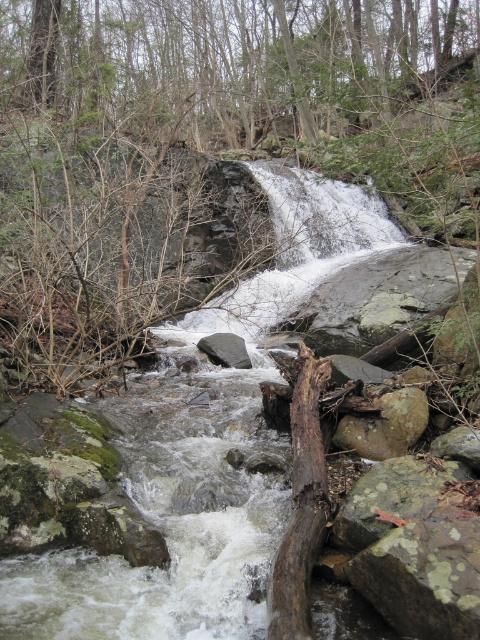
Who is lower down, brown rough log at center or gray rock at center?

brown rough log at center is below.

Who is more distant from viewer, [304,403] or [232,337]?

The point [232,337] is more distant.

Is point (324, 451) positioned in front of point (228, 364)?

Yes, it is in front of point (228, 364).

The width and height of the screenshot is (480, 640). I want to click on brown rough log at center, so click(300, 504).

Consider the image. Is green leafy tree at upper center to the right of brown rough rock at center from the viewer's perspective?

No, green leafy tree at upper center is not to the right of brown rough rock at center.

Who is more forward, (x=96, y=65) or (x=417, y=412)?

Positioned in front is point (x=417, y=412).

Locate an element on the screen. green leafy tree at upper center is located at coordinates (225, 64).

Which is more to the right, white rocky stream at center or gray rock at center?

white rocky stream at center is more to the right.

Is white rocky stream at center to the left of gray rock at center from the viewer's perspective?

In fact, white rocky stream at center is to the right of gray rock at center.

Is point (201, 356) positioned in front of point (231, 344)?

That is True.

The image size is (480, 640). In order to click on white rocky stream at center in this screenshot , I will do 201,449.